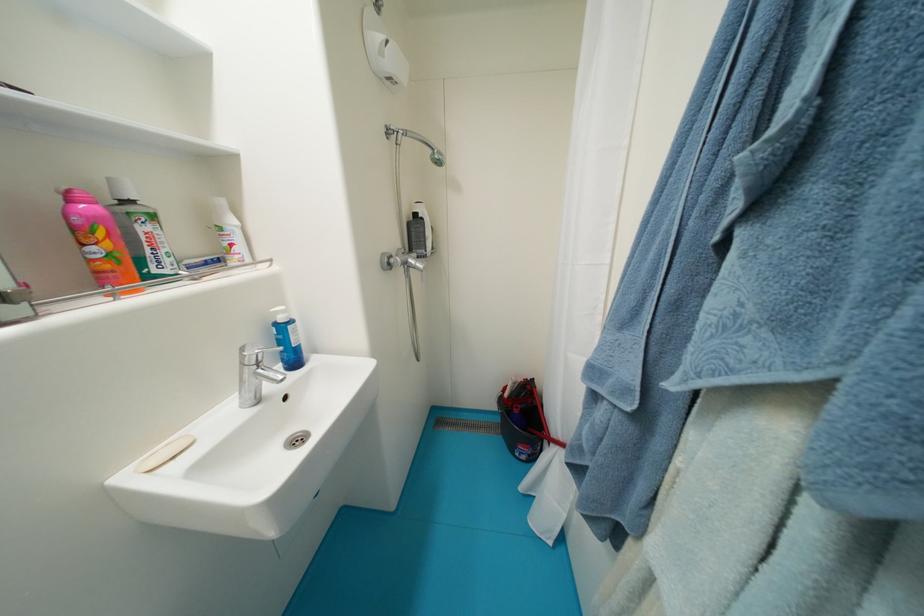
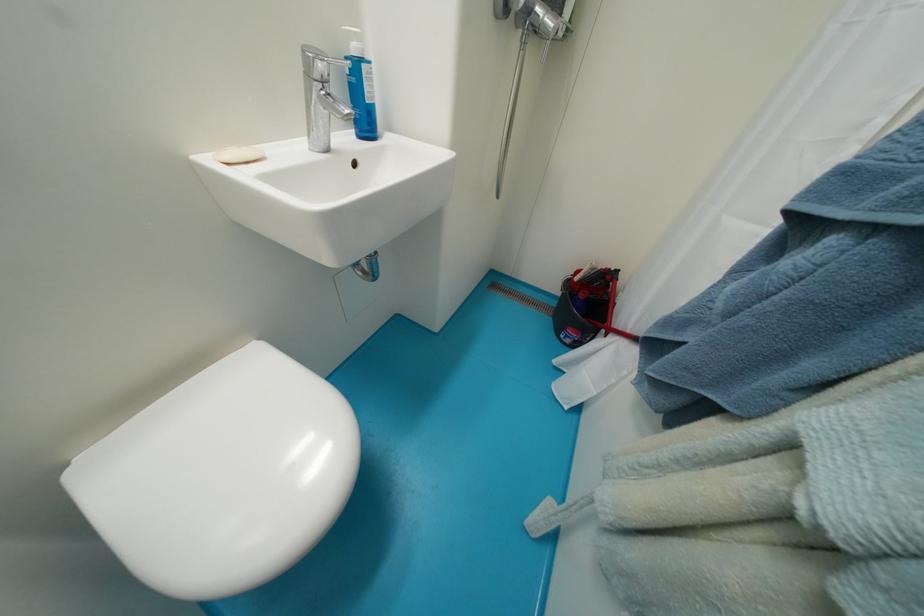
The point at (249, 366) is marked in the first image. Where is the corresponding point in the second image?

(313, 78)